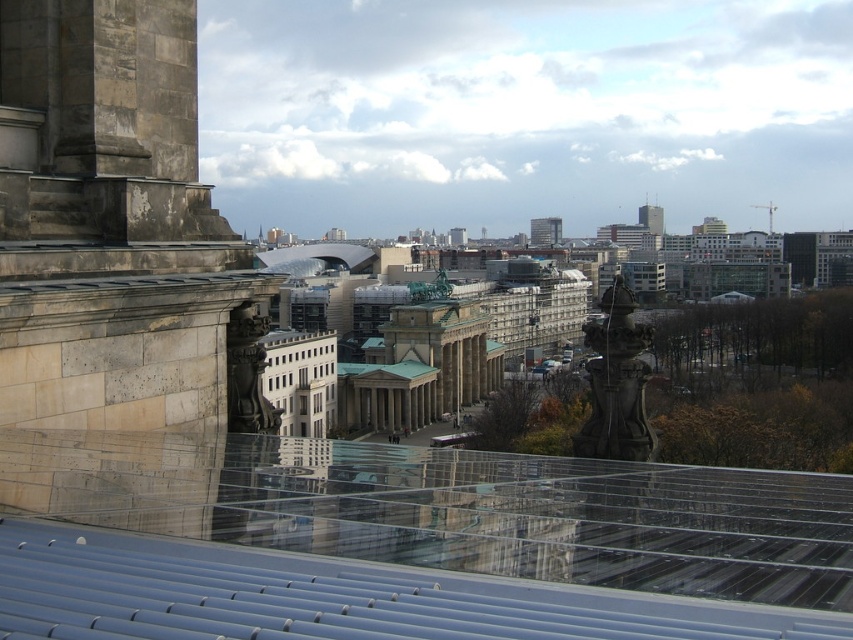
You are an architect analyzing the cityscape. Which object, the polished stone column at center or the metallic glass tower at center, has a greater height?

The polished stone column at center is taller than the metallic glass tower at center according to the description.

You are standing at the point marked as point (408, 545) in the cityscape image. What architectural feature are you directly under?

You are directly under the transparent glass roof at center.

You are standing on the glass floor and looking towards the transparent glass roof at center and the beige stone tower at left. Which object is closer to you?

The transparent glass roof at center is closer to you because it is in front of the beige stone tower at left.